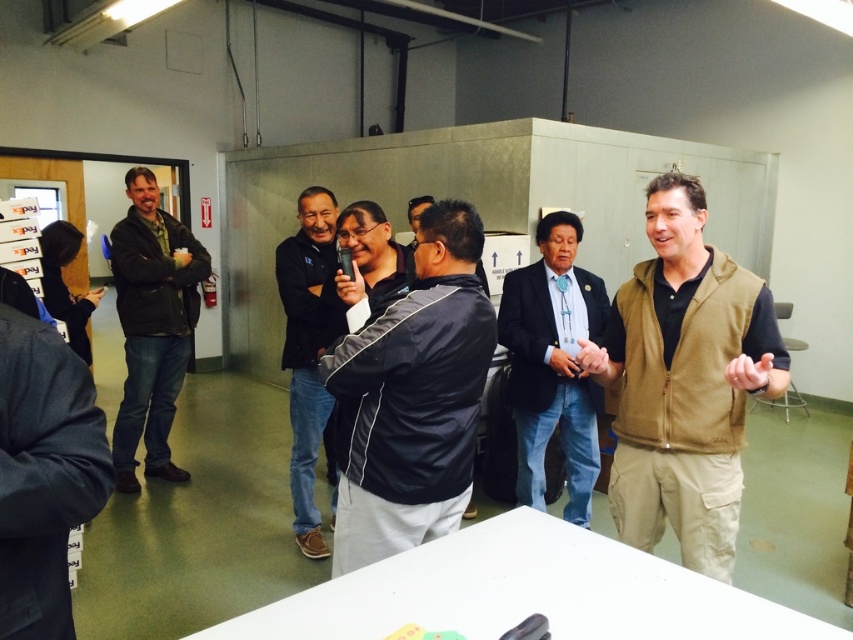
You are a photographer setting up for an event in this industrial space. You have a camera that requires a table larger than the dark blue jacket at center to place equipment. Is the white glossy table at lower center suitable for your setup?

The white glossy table at lower center is smaller than the dark blue jacket at center, so it is not large enough to accommodate the equipment requiring a table larger than the jacket. Choose a larger table.

You are a photographer standing at the entrance of the warehouse. You want to take a photo of the blue denim jeans at center and the dark brown leather jacket at left. The minimum distance between the two objects for a clear shot is 2 meters. Can you capture both in the same frame?

The blue denim jeans at center is 2.09 meters from the dark brown leather jacket at left, so yes, the photographer can capture both in the same frame since the distance meets the minimum requirement of 2 meters.

You are standing at the entrance of the warehouse and see the blue denim jeans at center and the dark brown leather jacket at left. Which object is closer to you?

The blue denim jeans at center is closer to you because it is in front of the dark brown leather jacket at left.